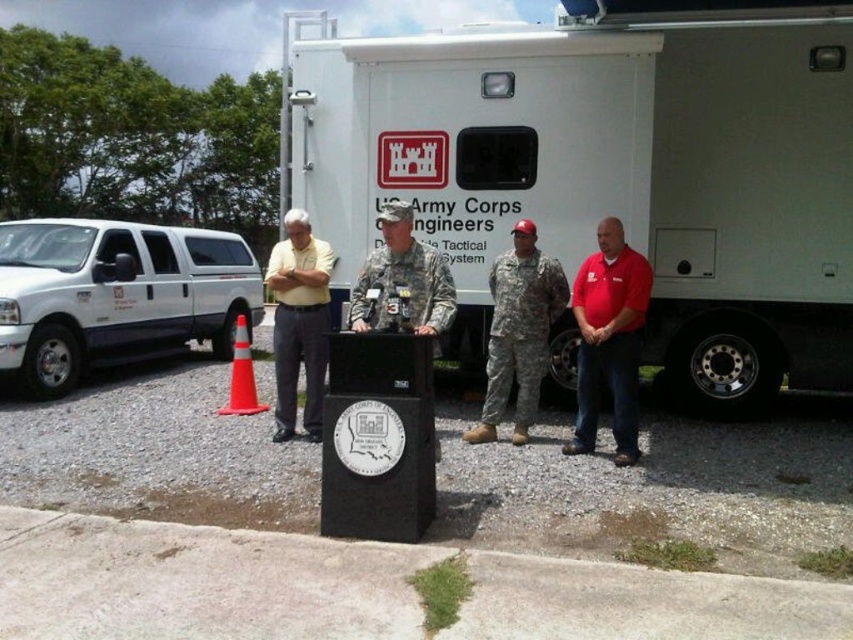
You are a delivery person who needs to place a package between the camouflage fabric soldier at center and the orange reflective cone at lower left. The package requires a space of 3 meters to fit. Is there enough space between them?

The distance between the camouflage fabric soldier at center and the orange reflective cone at lower left is 2.90 meters, which is slightly less than the required 3 meters. Therefore, there isn not enough space to place the package between them.

You are a photographer setting up a tripod to capture a group photo of the camouflage fabric soldier at center and the orange reflective cone at lower left. The tripod has a height limit of 1.8 meters. Can you fit both subjects within the tripod height capacity?

The camouflage fabric soldier at center is much taller than the orange reflective cone at lower left. Since the tripod has a height limit of 1.8 meters, you need to ensure the soldier is within this height. If the soldier exceeds 1.8 meters, the tripod won